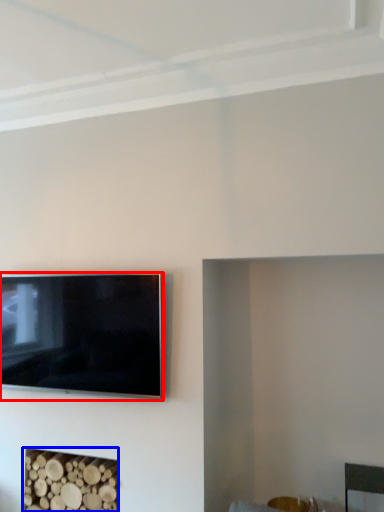
Question: Among these objects, which one is farthest to the camera, television (highlighted by a red box) or fireplace (highlighted by a blue box)?

Choices:
 (A) television
 (B) fireplace

Answer: (B)